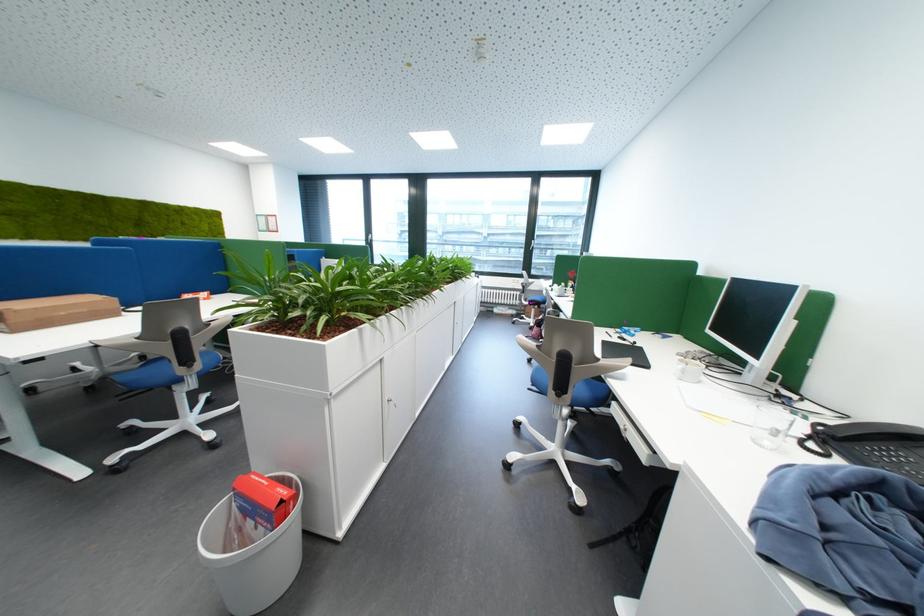
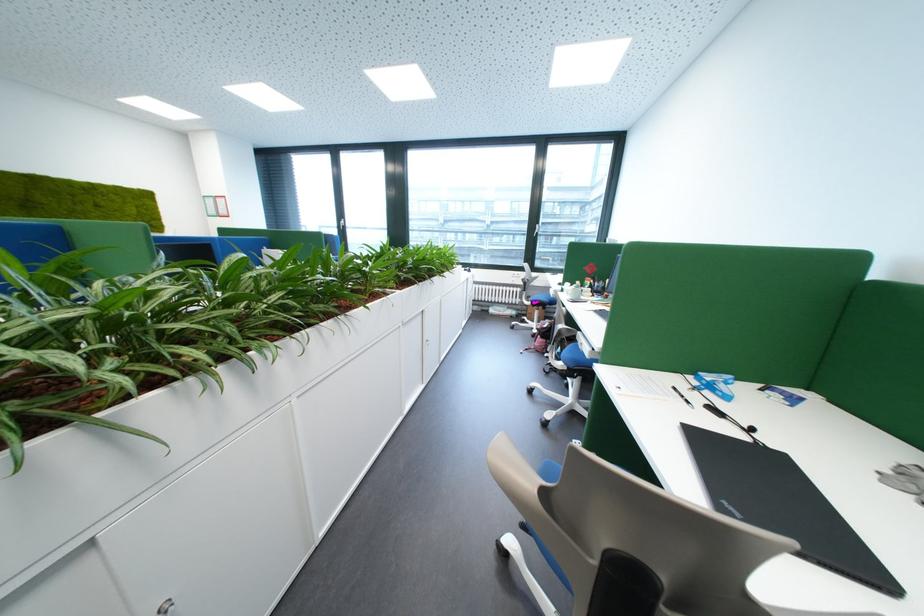
Question: What movement of the cameraman would produce the second image?

Choices:
 (A) Left
 (B) Right
 (C) Forward
 (D) Backward

Answer: (C)